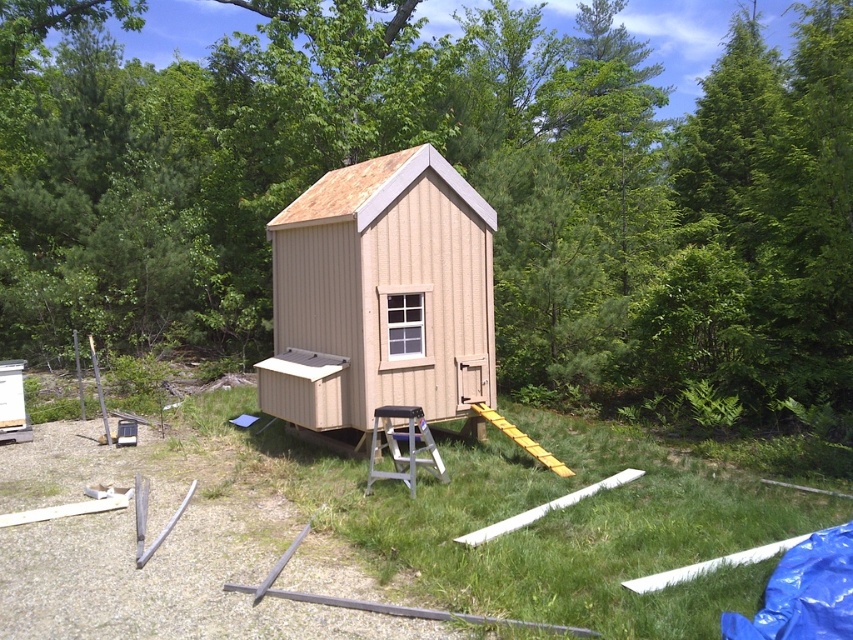
Question: Which point is closer to the camera taking this photo?

Choices:
 (A) (474, 211)
 (B) (386, 426)
 (C) (506, 420)
 (D) (415, 56)

Answer: (B)

Question: Among these points, which one is nearest to the camera?

Choices:
 (A) (496, 413)
 (B) (312, 6)

Answer: (A)

Question: Is green leafy tree at center to the left of yellow plastic ramp at center from the viewer's perspective?

Choices:
 (A) yes
 (B) no

Answer: (B)

Question: Can you confirm if green leafy tree at center is positioned to the left of yellow plastic ramp at center?

Choices:
 (A) no
 (B) yes

Answer: (A)

Question: Does tan wood cabin at center appear over yellow plastic ramp at center?

Choices:
 (A) yes
 (B) no

Answer: (A)

Question: Which of the following is the closest to the observer?

Choices:
 (A) (448, 480)
 (B) (564, 465)
 (C) (636, 352)
 (D) (469, 323)

Answer: (A)